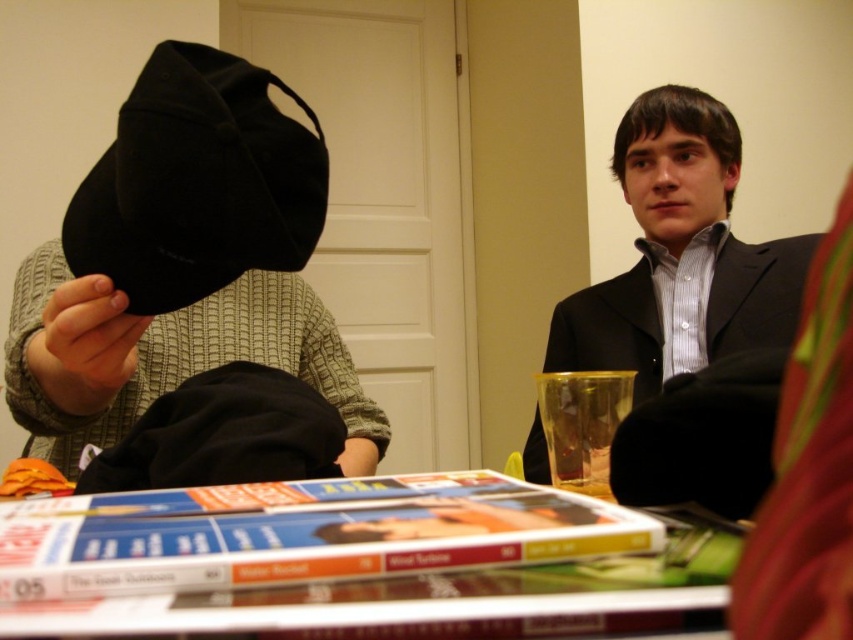
Is matte plastic magazines at center to the left of matte black cap at left from the viewer's perspective?

Incorrect, matte plastic magazines at center is not on the left side of matte black cap at left.

Does point (503, 563) lie in front of point (294, 372)?

Yes, point (503, 563) is closer to viewer.

Between point (53, 580) and point (216, 83), which one is positioned behind?

The point (216, 83) is more distant.

This screenshot has width=853, height=640. What are the coordinates of `matte plastic magazines at center` in the screenshot? It's located at (352, 563).

Does black velvet cap at upper left come in front of black matte suit at upper right?

Yes, it is in front of black matte suit at upper right.

Does black velvet cap at upper left appear on the right side of black matte suit at upper right?

Incorrect, black velvet cap at upper left is not on the right side of black matte suit at upper right.

Is point (90, 189) farther from viewer compared to point (659, 282)?

That is False.

Locate an element on the screen. black velvet cap at upper left is located at coordinates (198, 182).

Who is higher up, matte black cap at left or black matte suit at upper right?

Positioned higher is black matte suit at upper right.

Can you confirm if matte black cap at left is positioned below black matte suit at upper right?

Yes, matte black cap at left is below black matte suit at upper right.

Is point (99, 182) more distant than point (654, 273)?

That is False.

Where is `matte black cap at left`? matte black cap at left is located at coordinates (183, 262).